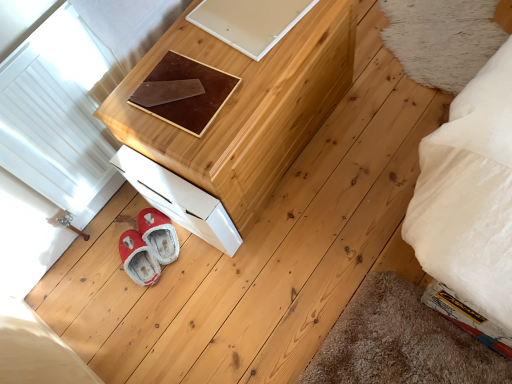
Image resolution: width=512 pixels, height=384 pixels. I want to click on free location in front of white glossy drawer at lower left, so click(206, 280).